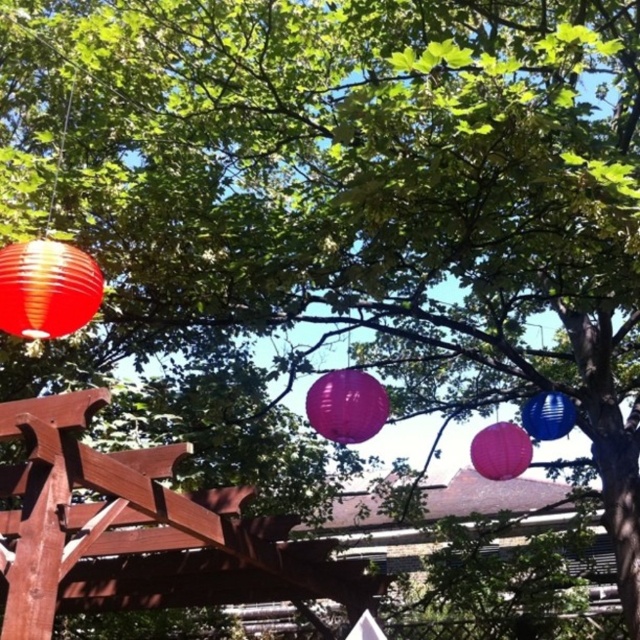
You are planning to hang a new string of fairy lights between the purple paper lantern at center and the blue glossy lantern at right. Given their heights, which lantern should you attach the lights to so they hang evenly?

The purple paper lantern at center is much taller than the blue glossy lantern at right, so you should attach the fairy lights to the purple paper lantern at center to ensure they hang evenly.

You are planning to hang a new lantern in this outdoor space. The purple paper lantern at center is currently taking up more space than the blue glossy lantern at right. Which lantern should you consider replacing if you want to reduce the visual impact of the larger one?

The purple paper lantern at center is larger in size than the blue glossy lantern at right, so you should consider replacing the purple paper lantern at center to reduce the visual impact.